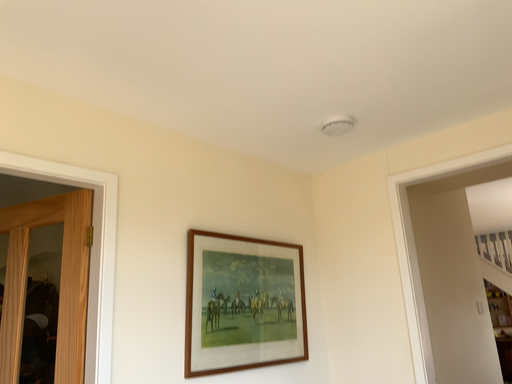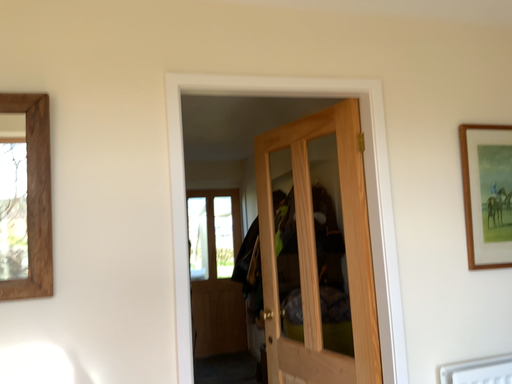
Question: Which way did the camera rotate in the video?

Choices:
 (A) rotated left
 (B) rotated right

Answer: (A)